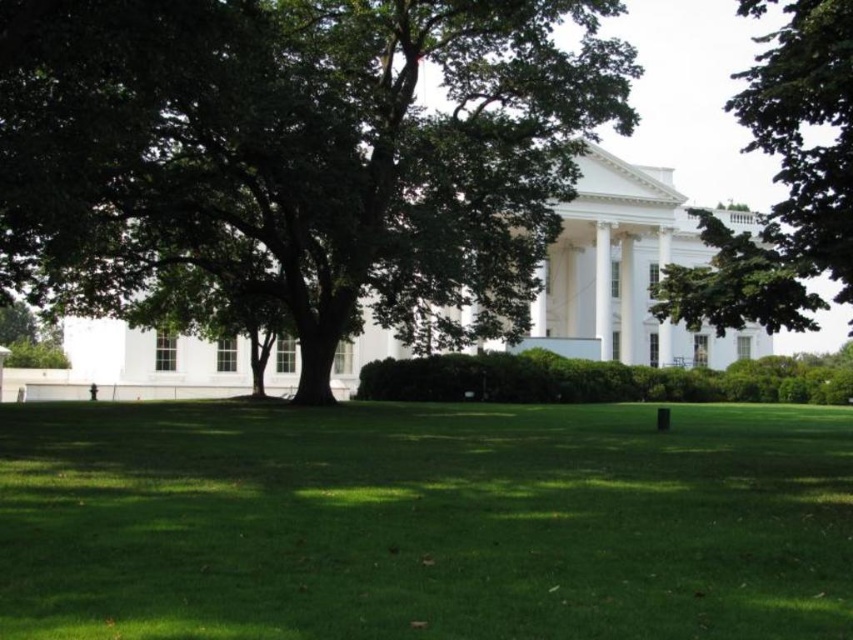
You are standing in front of the white neoclassical building with columns and a lawn. You want to place a 100 feet long banner from your current position to the point marked as point (483, 52). Is the distance sufficient for the banner to reach that point?

The point (483, 52) is 98.40 feet away from the camera, so yes, the 100 feet long banner is sufficient to reach that point.

You are standing in front of a government building and want to walk from the green grass at center to the green leafy tree at upper right. Which direction should you head?

You should head to the right because the green grass at center is to the left of the green leafy tree at upper right, meaning the tree is on the right side relative to the grass.

You are standing at the point closest to the building in the image. Which of the two points, point (306,38) or point (828,228), is further away from you?

Point (306,38) is behind point (828,228), so it is further away from you.